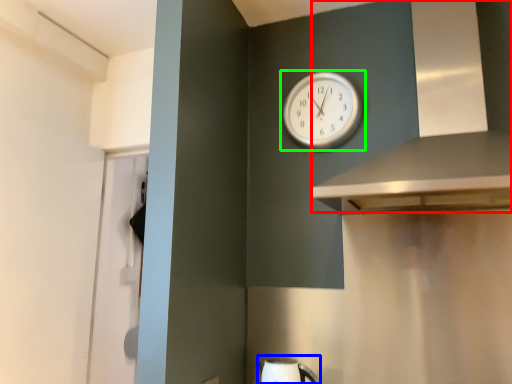
Question: Which object is positioned closest to vent (highlighted by a red box)? Select from sink (highlighted by a blue box) and wall clock (highlighted by a green box).

Choices:
 (A) sink
 (B) wall clock

Answer: (B)